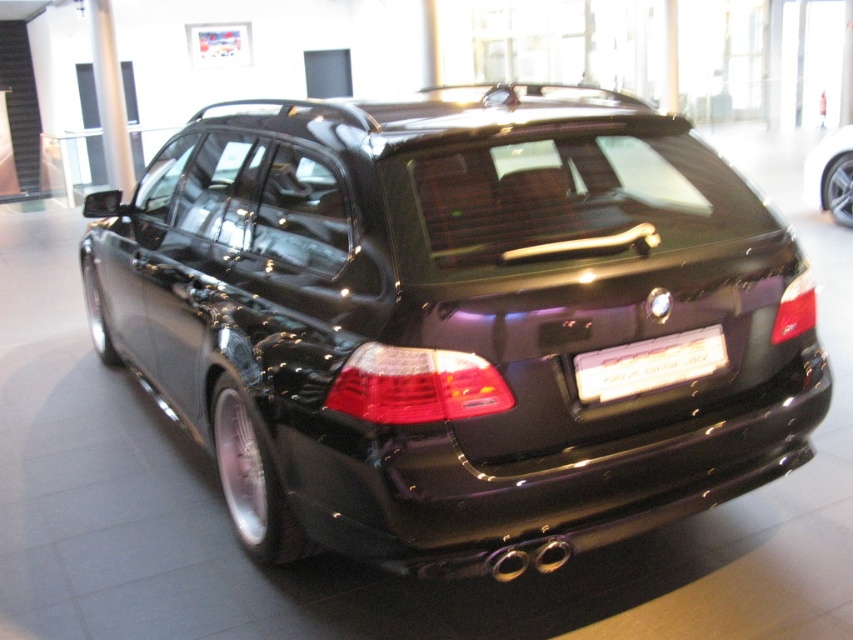
Question: Estimate the real-world distances between objects in this image. Which object is farther from the shiny black car at center?

Choices:
 (A) glossy black car at center
 (B) white plastic license plate at center

Answer: (A)

Question: Can you confirm if shiny black car at center is positioned below white plastic license plate at center?

Choices:
 (A) yes
 (B) no

Answer: (B)

Question: Which object is the closest to the shiny black car at center?

Choices:
 (A) white plastic license plate at center
 (B) glossy black car at center

Answer: (A)

Question: Which object appears closest to the camera in this image?

Choices:
 (A) glossy black car at center
 (B) shiny black car at center
 (C) white plastic license plate at center

Answer: (B)

Question: Does white plastic license plate at center have a lesser width compared to glossy black car at center?

Choices:
 (A) no
 (B) yes

Answer: (A)

Question: Can you confirm if white plastic license plate at center is positioned to the right of glossy black car at center?

Choices:
 (A) no
 (B) yes

Answer: (A)